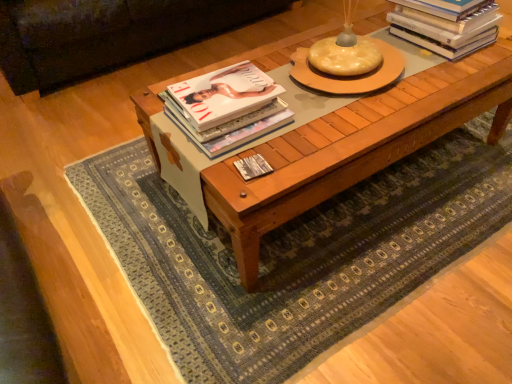
Question: Is white glossy book at center, the third book viewed from the top, inside or outside of matte hardcover book at center, the second book from the bottom?

Choices:
 (A) outside
 (B) inside

Answer: (A)

Question: From the image's perspective, is white glossy book at center, the 2th book when ordered from right to left, positioned above or below matte hardcover book at center, which is the 3th book in right-to-left order?

Choices:
 (A) above
 (B) below

Answer: (B)

Question: Which object is the farthest from the dark brown leather couch at upper left?

Choices:
 (A) white glossy book at center, placed as the 2th book when sorted from left to right
 (B) woven rug at center
 (C) wooden coffee table at center
 (D) hardcover books at upper right, positioned as the 1th book in right-to-left order
 (E) matte hardcover book at center, which appears as the 1th book when viewed from the left

Answer: (A)

Question: Which of these objects is positioned farthest from the dark brown leather couch at upper left?

Choices:
 (A) woven rug at center
 (B) hardcover books at upper right, positioned as the 1th book in right-to-left order
 (C) wooden coffee table at center
 (D) white glossy book at center, the 1th book positioned from the bottom
 (E) matte hardcover book at center, which is the 3th book in right-to-left order

Answer: (D)